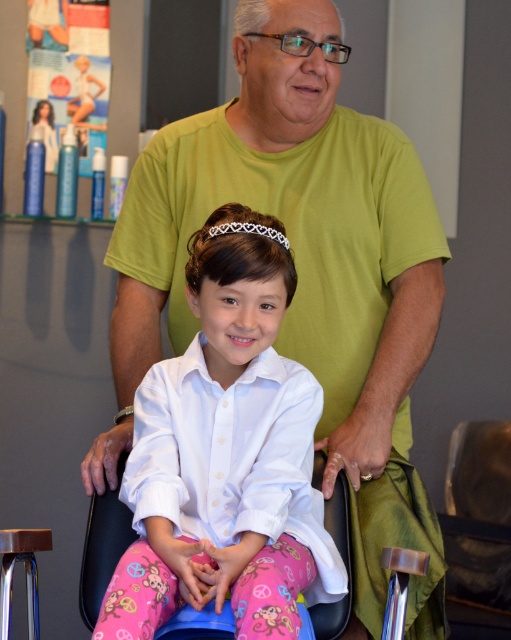
Question: Does white satin shirt at center have a smaller size compared to white lace tiara at center?

Choices:
 (A) no
 (B) yes

Answer: (A)

Question: Is pink fabric wheelchair at center wider than white lace tiara at center?

Choices:
 (A) yes
 (B) no

Answer: (B)

Question: Which point appears farthest from the camera in this image?

Choices:
 (A) (407, 387)
 (B) (278, 236)

Answer: (A)

Question: Which of these objects is positioned closest to the white satin shirt at center?

Choices:
 (A) green cotton shirt at center
 (B) white lace tiara at center

Answer: (A)

Question: In this image, where is white satin shirt at center located relative to white lace tiara at center?

Choices:
 (A) below
 (B) above

Answer: (A)

Question: Which point is closer to the camera?

Choices:
 (A) white satin shirt at center
 (B) green cotton shirt at center
 (C) pink fabric wheelchair at center

Answer: (A)